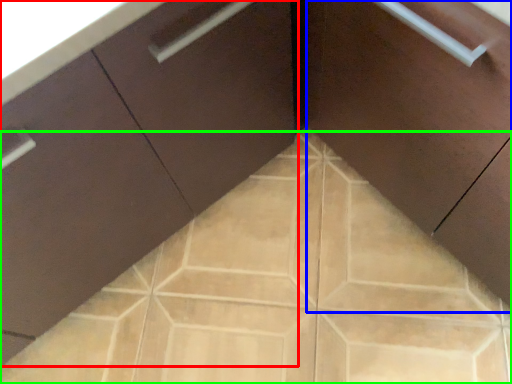
Question: Based on their relative distances, which object is nearer to cabinetry (highlighted by a red box)? Choose from cabinetry (highlighted by a blue box) and ceramic tile (highlighted by a green box).

Choices:
 (A) cabinetry
 (B) ceramic tile

Answer: (B)